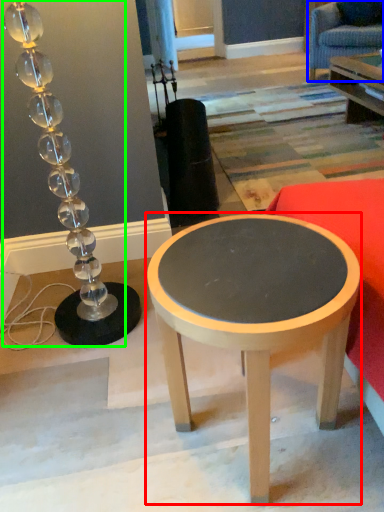
Question: Which object is positioned farthest from coffee table (highlighted by a red box)? Select from swivel chair (highlighted by a blue box) and lamp (highlighted by a green box).

Choices:
 (A) swivel chair
 (B) lamp

Answer: (A)